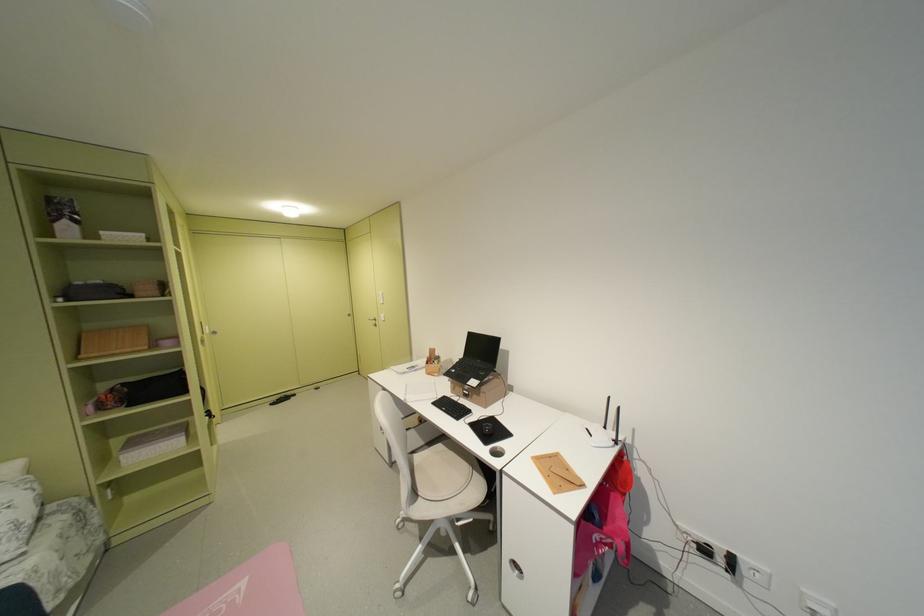
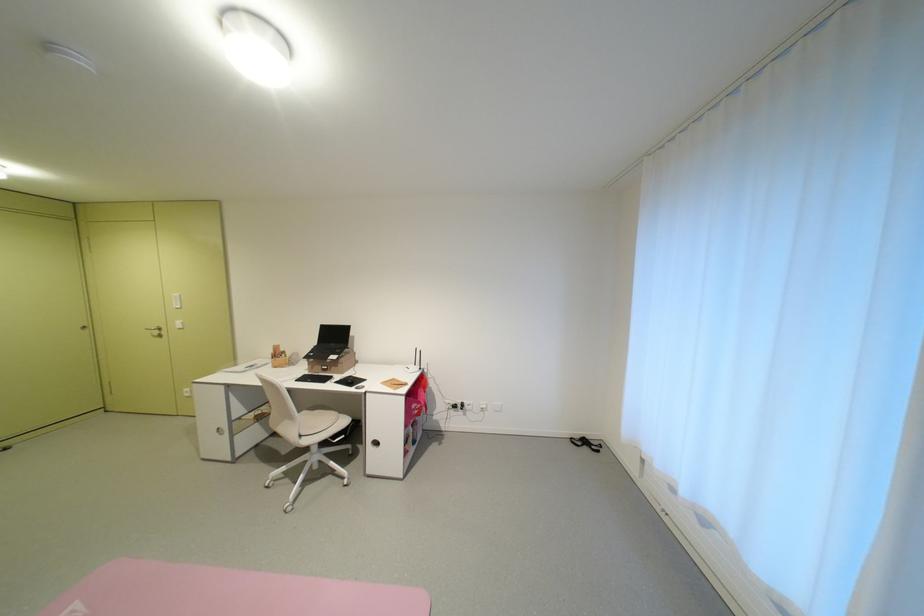
Find the pixel in the second image that matches pixel 488 397 in the first image.

(346, 368)